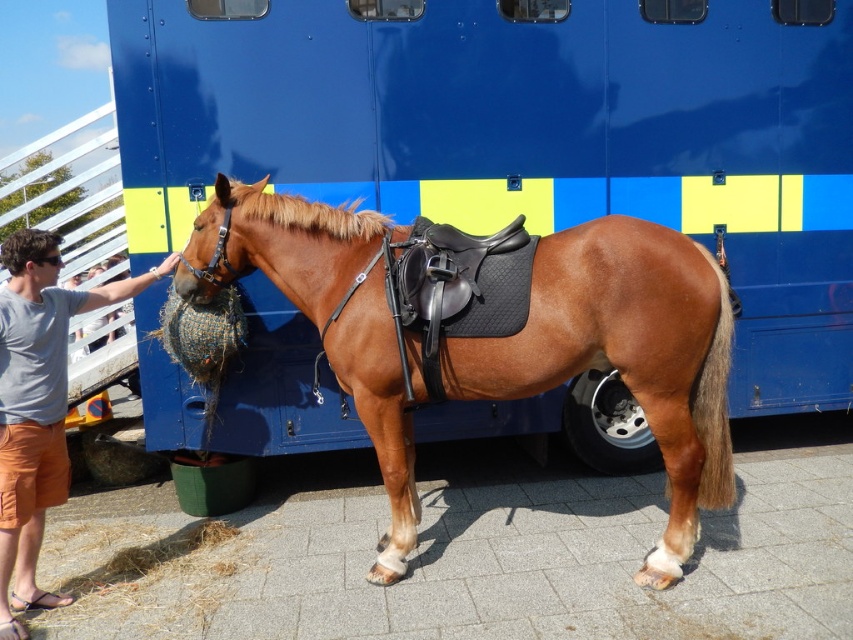
Between point (444, 358) and point (109, 301), which one is positioned in front?

Point (444, 358) is more forward.

Image resolution: width=853 pixels, height=640 pixels. What are the coordinates of `brown glossy horse at center` in the screenshot? It's located at (625, 355).

At what (x,y) coordinates should I click in order to perform the action: click on brown glossy horse at center. Please return your answer as a coordinate pair (x, y). The width and height of the screenshot is (853, 640). Looking at the image, I should click on (625, 355).